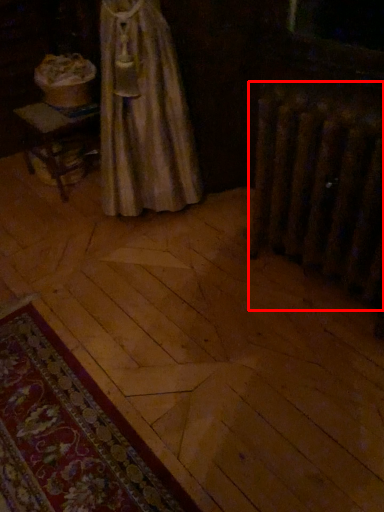
Question: From the image's perspective, where is radiator (annotated by the red box) located in relation to mat in the image?

Choices:
 (A) above
 (B) below

Answer: (A)